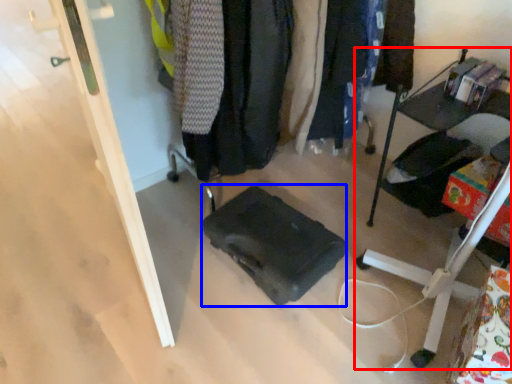
Question: Which object is further to the camera taking this photo, furniture (highlighted by a red box) or luggage (highlighted by a blue box)?

Choices:
 (A) furniture
 (B) luggage

Answer: (B)